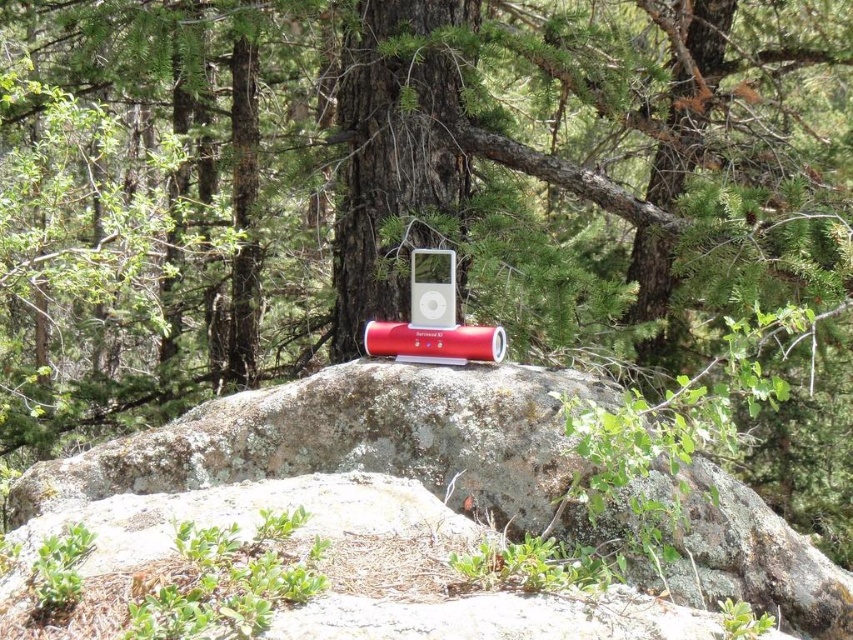
Is gray rock at center further to the viewer compared to satin silver ipod at center?

No, it is in front of satin silver ipod at center.

Does gray rock at center appear over satin silver ipod at center?

Incorrect, gray rock at center is not positioned above satin silver ipod at center.

Which is in front, point (334, 387) or point (451, 252)?

Positioned in front is point (334, 387).

Where is `gray rock at center`? The image size is (853, 640). gray rock at center is located at coordinates (347, 438).

Does gray rock at center lie behind red matte speaker at center?

That is False.

In the scene shown: Can you confirm if gray rock at center is thinner than red matte speaker at center?

Incorrect, gray rock at center's width is not less than red matte speaker at center's.

Between point (496, 465) and point (460, 344), which one is positioned in front?

Positioned in front is point (496, 465).

Where is `gray rock at center`? gray rock at center is located at coordinates (347, 438).

Does red matte speaker at center have a lesser width compared to satin silver ipod at center?

No, red matte speaker at center is not thinner than satin silver ipod at center.

Locate an element on the screen. The image size is (853, 640). red matte speaker at center is located at coordinates (434, 342).